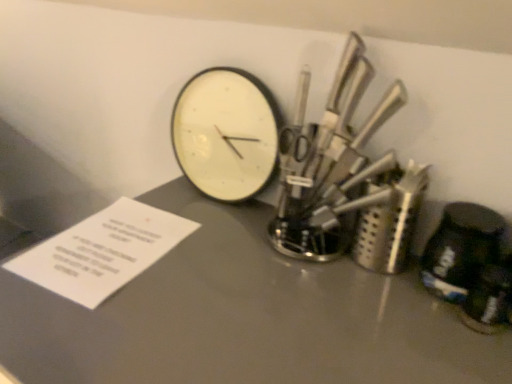
Question: Is polished metal knife set at upper right beside matte gray table at center?

Choices:
 (A) no
 (B) yes

Answer: (A)

Question: Does polished metal knife set at upper right appear on the left side of matte gray table at center?

Choices:
 (A) yes
 (B) no

Answer: (B)

Question: Is polished metal knife set at upper right completely or partially outside of matte gray table at center?

Choices:
 (A) yes
 (B) no

Answer: (A)

Question: Are polished metal knife set at upper right and matte gray table at center located far from each other?

Choices:
 (A) yes
 (B) no

Answer: (B)

Question: Considering the relative sizes of polished metal knife set at upper right and matte gray table at center in the image provided, is polished metal knife set at upper right shorter than matte gray table at center?

Choices:
 (A) yes
 (B) no

Answer: (A)

Question: From their relative heights in the image, would you say white paper at lower left is taller or shorter than polished metal knife set at upper right?

Choices:
 (A) short
 (B) tall

Answer: (A)

Question: Looking at their shapes, would you say white paper at lower left is wider or thinner than polished metal knife set at upper right?

Choices:
 (A) thin
 (B) wide

Answer: (B)

Question: Does point pos(61,236) appear closer or farther from the camera than point pos(362,48)?

Choices:
 (A) closer
 (B) farther

Answer: (B)

Question: Based on their positions, is white paper at lower left located to the left or right of polished metal knife set at upper right?

Choices:
 (A) left
 (B) right

Answer: (A)

Question: Visually, is white paper at lower left positioned to the left or to the right of white matte wall clock at center?

Choices:
 (A) left
 (B) right

Answer: (A)

Question: Based on their sizes in the image, would you say white paper at lower left is bigger or smaller than white matte wall clock at center?

Choices:
 (A) small
 (B) big

Answer: (A)

Question: From a real-world perspective, relative to white matte wall clock at center, is white paper at lower left vertically above or below?

Choices:
 (A) below
 (B) above

Answer: (A)

Question: Which is correct: white paper at lower left is inside white matte wall clock at center, or outside of it?

Choices:
 (A) inside
 (B) outside

Answer: (B)

Question: From the image's perspective, is polished metal knife set at upper right positioned above or below white paper at lower left?

Choices:
 (A) below
 (B) above

Answer: (B)

Question: Considering the positions of point (343, 162) and point (88, 304), is point (343, 162) closer or farther from the camera than point (88, 304)?

Choices:
 (A) closer
 (B) farther

Answer: (B)